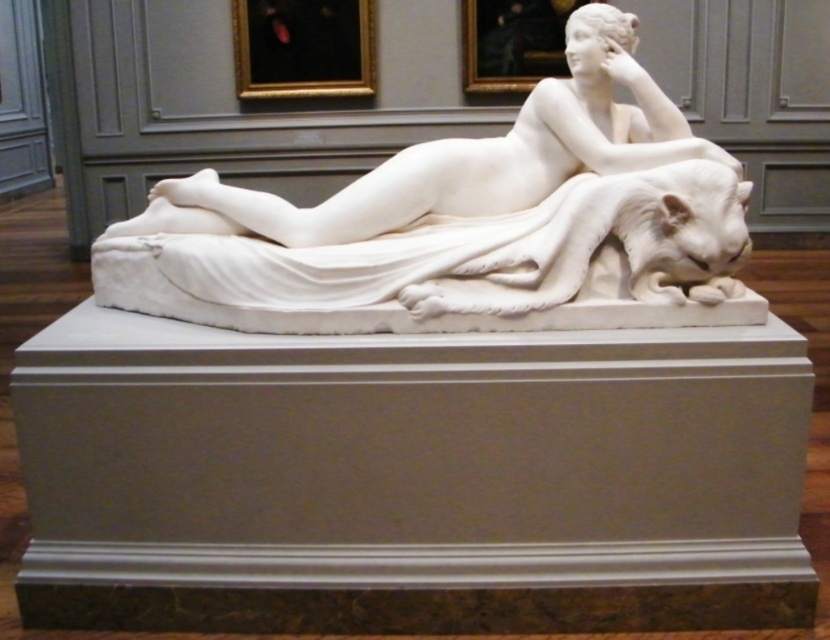
Question: Among these points, which one is farthest from the camera?

Choices:
 (A) (496, 156)
 (B) (350, 268)

Answer: (A)

Question: Is white marble sculpture at center to the right of white marble statue at center from the viewer's perspective?

Choices:
 (A) yes
 (B) no

Answer: (A)

Question: Which point is closer to the camera?

Choices:
 (A) [562, 273]
 (B) [533, 173]

Answer: (A)

Question: Is white marble sculpture at center above white marble statue at center?

Choices:
 (A) no
 (B) yes

Answer: (A)

Question: Is white marble sculpture at center thinner than white marble statue at center?

Choices:
 (A) yes
 (B) no

Answer: (B)

Question: Which point is closer to the camera taking this photo?

Choices:
 (A) (208, 170)
 (B) (510, 289)

Answer: (B)